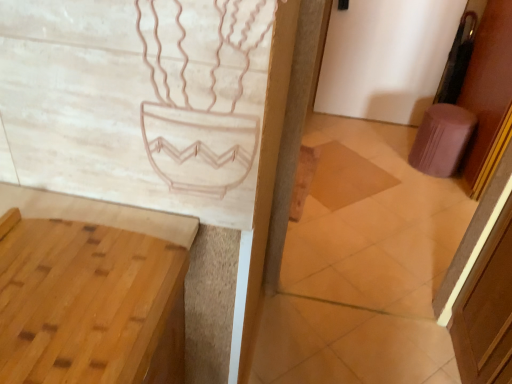
Find the location of `blank space situated above light brown wood vanity at lower left (from a real-world perspective)`. blank space situated above light brown wood vanity at lower left (from a real-world perspective) is located at coordinates (72, 270).